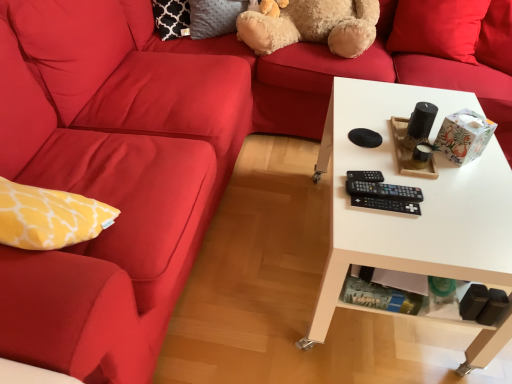
Identify the location of black plastic remote at center, the first control from the back. (365, 176).

Where is `red matte pillow at upper right`? Image resolution: width=512 pixels, height=384 pixels. red matte pillow at upper right is located at coordinates [x=438, y=28].

Identify the location of table that appears on the right of black plastic remote at center, which is the second control from front to back. This screenshot has width=512, height=384. (420, 204).

In the image, is black plastic remote at center, which ranks as the 2th control in back-to-front order, positioned in front of or behind white glossy table at right?

Visually, black plastic remote at center, which ranks as the 2th control in back-to-front order, is located behind white glossy table at right.

Is black plastic remote at center, which is the second control from front to back, aimed at white glossy table at right?

Yes, black plastic remote at center, which is the second control from front to back, is turned towards white glossy table at right.

Is black plastic remote at center, which is the second control from front to back, wider than white glossy table at right?

No, black plastic remote at center, which is the second control from front to back, is not wider than white glossy table at right.

Can you see black plastic remote at center, the 1th control when ordered from front to back, touching black plastic remote at center, the first control from the back?

Absolutely, black plastic remote at center, the 1th control when ordered from front to back, is next to and touching black plastic remote at center, the first control from the back.

Considering the relative positions of black plastic remote at center, which appears as the 3th control when viewed from the back, and black plastic remote at center, the first control from the back, in the image provided, is black plastic remote at center, which appears as the 3th control when viewed from the back, to the left of black plastic remote at center, the first control from the back, from the viewer's perspective?

Incorrect, black plastic remote at center, which appears as the 3th control when viewed from the back, is not on the left side of black plastic remote at center, the first control from the back.

You are a GUI agent. You are given a task and a screenshot of the screen. Output one action in this format:
    pyautogui.click(x=<x>, y=<y>)
    Task: Click on the control that is the 2nd one when counting forward from the black plastic remote at center, placed as the third control when sorted from front to back
    The width and height of the screenshot is (512, 384).
    Given the screenshot: What is the action you would take?
    pyautogui.click(x=386, y=204)

In the scene shown: How many degrees apart are the facing directions of black plastic remote at center, the 1th control when ordered from front to back, and black plastic remote at center, placed as the third control when sorted from front to back?

6.46 degrees.

Considering the relative sizes of fuzzy beige teddy bear at upper center and white glossy table at right in the image provided, is fuzzy beige teddy bear at upper center smaller than white glossy table at right?

Indeed, fuzzy beige teddy bear at upper center has a smaller size compared to white glossy table at right.

Does fuzzy beige teddy bear at upper center have a greater height compared to white glossy table at right?

No.

Is fuzzy beige teddy bear at upper center positioned beyond the bounds of white glossy table at right?

Yes, fuzzy beige teddy bear at upper center is outside of white glossy table at right.

From a real-world perspective, is fuzzy beige teddy bear at upper center positioned above or below white glossy table at right?

fuzzy beige teddy bear at upper center is above white glossy table at right.

Considering the sizes of objects red matte pillow at upper right and fuzzy beige teddy bear at upper center in the image provided, who is smaller, red matte pillow at upper right or fuzzy beige teddy bear at upper center?

red matte pillow at upper right is smaller.

Is point (447, 15) closer to viewer compared to point (349, 35)?

That is False.

Is red matte pillow at upper right inside or outside of fuzzy beige teddy bear at upper center?

red matte pillow at upper right exists outside the volume of fuzzy beige teddy bear at upper center.

Considering the positions of point (256, 46) and point (358, 171), is point (256, 46) closer or farther from the camera than point (358, 171)?

Point (256, 46) is positioned farther from the camera compared to point (358, 171).

Is fuzzy beige teddy bear at upper center oriented away from black plastic remote at center, the first control from the back?

fuzzy beige teddy bear at upper center is not turned away from black plastic remote at center, the first control from the back.

Could you measure the distance between fuzzy beige teddy bear at upper center and black plastic remote at center, the first control from the back?

fuzzy beige teddy bear at upper center is 1.06 meters from black plastic remote at center, the first control from the back.

Looking at this image, from the image's perspective, is fuzzy beige teddy bear at upper center above or below black plastic remote at center, placed as the third control when sorted from front to back?

Clearly, from the image's perspective, fuzzy beige teddy bear at upper center is above black plastic remote at center, placed as the third control when sorted from front to back.

Consider the image. Between fuzzy beige teddy bear at upper center and red matte pillow at upper right, which one has smaller size?

red matte pillow at upper right is smaller.

Is fuzzy beige teddy bear at upper center wider or thinner than red matte pillow at upper right?

In the image, fuzzy beige teddy bear at upper center appears to be wider than red matte pillow at upper right.

In terms of height, does fuzzy beige teddy bear at upper center look taller or shorter compared to red matte pillow at upper right?

fuzzy beige teddy bear at upper center is shorter than red matte pillow at upper right.

Is white glossy table at right at the left side of black plastic remote at center, which appears as the 3th control when viewed from the back?

In fact, white glossy table at right is to the right of black plastic remote at center, which appears as the 3th control when viewed from the back.

In the scene shown: From a real-world perspective, is white glossy table at right physically located above or below black plastic remote at center, which appears as the 3th control when viewed from the back?

From a real-world perspective, white glossy table at right is physically below black plastic remote at center, which appears as the 3th control when viewed from the back.

Based on the photo, can you confirm if white glossy table at right is bigger than black plastic remote at center, the 1th control when ordered from front to back?

Indeed, white glossy table at right has a larger size compared to black plastic remote at center, the 1th control when ordered from front to back.

Considering the positions of point (468, 206) and point (390, 202), is point (468, 206) closer or farther from the camera than point (390, 202)?

Point (468, 206) is positioned farther from the camera compared to point (390, 202).

You are a GUI agent. You are given a task and a screenshot of the screen. Output one action in this format:
    pyautogui.click(x=<x>, y=<y>)
    Task: Click on the table below the black plastic remote at center, which is the second control from front to back (from the image's perspective)
    The height and width of the screenshot is (384, 512).
    Given the screenshot: What is the action you would take?
    pyautogui.click(x=420, y=204)

Find the location of a particular element. The width and height of the screenshot is (512, 384). the 2nd control directly above the black plastic remote at center, the 1th control when ordered from front to back (from a real-world perspective) is located at coordinates (365, 176).

Considering their positions, is white glossy table at right positioned further to black plastic remote at center, the 1th control when ordered from front to back, than black plastic remote at center, placed as the third control when sorted from front to back?

white glossy table at right.

Estimate the real-world distances between objects in this image. Which object is further from fuzzy beige teddy bear at upper center, black plastic remote at center, which is the second control from front to back, or black plastic remote at center, placed as the third control when sorted from front to back?

The object further to fuzzy beige teddy bear at upper center is black plastic remote at center, which is the second control from front to back.

Based on their spatial positions, is red matte pillow at upper right or black plastic remote at center, the 1th control when ordered from front to back, further from black plastic remote at center, the first control from the back?

The object further to black plastic remote at center, the first control from the back, is red matte pillow at upper right.

Based on their spatial positions, is black plastic remote at center, the 1th control when ordered from front to back, or white glossy table at right closer to fuzzy beige teddy bear at upper center?

Among the two, white glossy table at right is located nearer to fuzzy beige teddy bear at upper center.

From the image, which object appears to be farther from fuzzy beige teddy bear at upper center, black plastic remote at center, placed as the third control when sorted from front to back, or black plastic remote at center, which is the second control from front to back?

black plastic remote at center, which is the second control from front to back, is positioned further to the anchor fuzzy beige teddy bear at upper center.

Looking at the image, which one is located further to fuzzy beige teddy bear at upper center, matte red couch at left or black plastic remote at center, which ranks as the 2th control in back-to-front order?

The object further to fuzzy beige teddy bear at upper center is black plastic remote at center, which ranks as the 2th control in back-to-front order.

Looking at the image, which one is located closer to black plastic remote at center, the 1th control when ordered from front to back, black plastic remote at center, placed as the third control when sorted from front to back, or black plastic remote at center, which is the second control from front to back?

black plastic remote at center, which is the second control from front to back.

Which object lies nearer to the anchor point red matte pillow at upper right, white glossy table at right or fuzzy beige teddy bear at upper center?

The object closer to red matte pillow at upper right is fuzzy beige teddy bear at upper center.

Identify the location of pillow between fuzzy beige teddy bear at upper center and white glossy table at right from top to bottom. (438, 28).

Image resolution: width=512 pixels, height=384 pixels. I want to click on control between white glossy table at right and black plastic remote at center, which ranks as the 2th control in back-to-front order, along the z-axis, so click(386, 204).

You are a GUI agent. You are given a task and a screenshot of the screen. Output one action in this format:
    pyautogui.click(x=<x>, y=<y>)
    Task: Click on the control situated between matte red couch at left and black plastic remote at center, which appears as the 3th control when viewed from the back, from left to right
    
    Given the screenshot: What is the action you would take?
    pyautogui.click(x=365, y=176)

Where is `table between matte red couch at left and fuzzy beige teddy bear at upper center in the front-back direction`? The height and width of the screenshot is (384, 512). table between matte red couch at left and fuzzy beige teddy bear at upper center in the front-back direction is located at coordinates (420, 204).